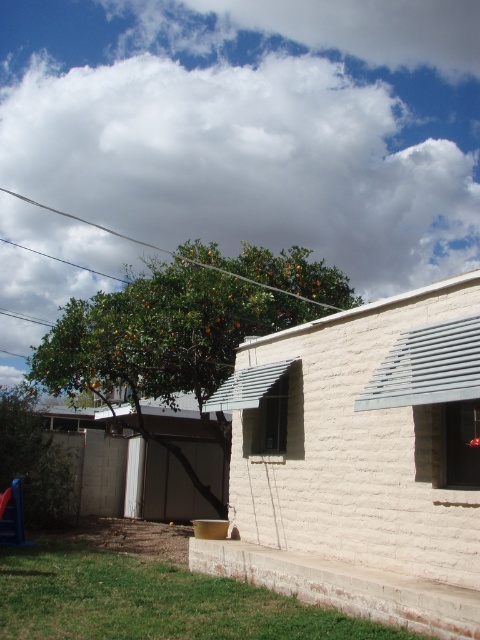
What are the coordinates of the green leafy tree at center in the image?

The green leafy tree at center is located at coordinates point (181,332).

Please provide the coordinates of the white stucco shed at lower right in the image. The coordinate system is defined as follows. The origin is at the bottom left corner of the image. The x axis increases to the right, and the y axis increases upward. The coordinates are normalized between 0 and 1. Please answer with the coordinates in the format of a tuple with two decimal numbers, rounded to three decimal places.

The coordinates of the white stucco shed at lower right are at point (360, 464).